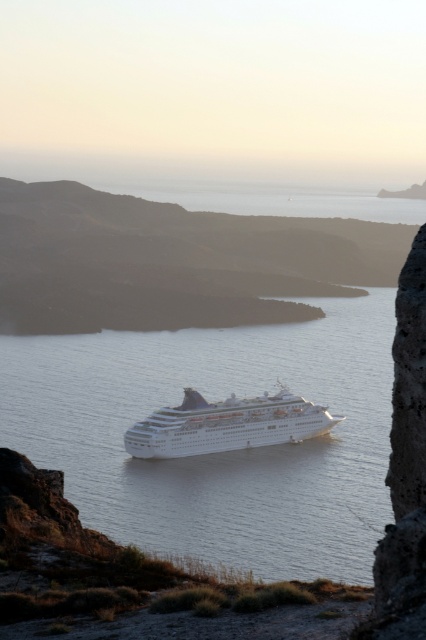
Question: Is white glossy water at center above white glossy cruise ship at center?

Choices:
 (A) no
 (B) yes

Answer: (B)

Question: Which object appears farthest from the camera in this image?

Choices:
 (A) white glossy cruise ship at center
 (B) white glossy water at center

Answer: (A)

Question: Where is white glossy water at center located in relation to white glossy cruise ship at center in the image?

Choices:
 (A) right
 (B) left

Answer: (A)

Question: Is white glossy water at center below white glossy cruise ship at center?

Choices:
 (A) no
 (B) yes

Answer: (A)

Question: Which object is farther from the camera taking this photo?

Choices:
 (A) white glossy water at center
 (B) white glossy cruise ship at center

Answer: (B)

Question: Which of the following is the closest to the observer?

Choices:
 (A) (187, 433)
 (B) (221, 486)

Answer: (B)